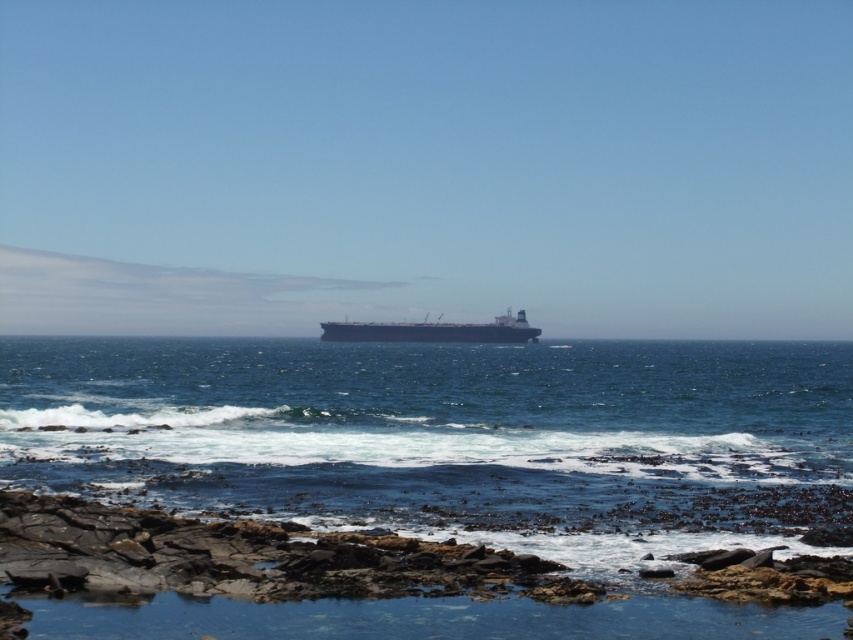
You are standing on the rocky shoreline and want to reach the point marked at coordinates point (805,404). Given that the safe wading depth for an average adult is up to 1 meter, can you safely walk to that point without getting deeper than 1 meter?

The distance of point (805,404) from camera is 72.51 meters, so the depth at that point is likely deeper than 1 meter. It is not safe to wade there.

Looking at this image, you are standing on the rocky shoreline and want to walk towards the ship on the horizon. Which point, point (492, 365) or point (405, 339), would you reach first if you walk straight ahead?

Point (492, 365) is in front of point (405, 339), so you would reach point (492, 365) first when walking straight ahead.